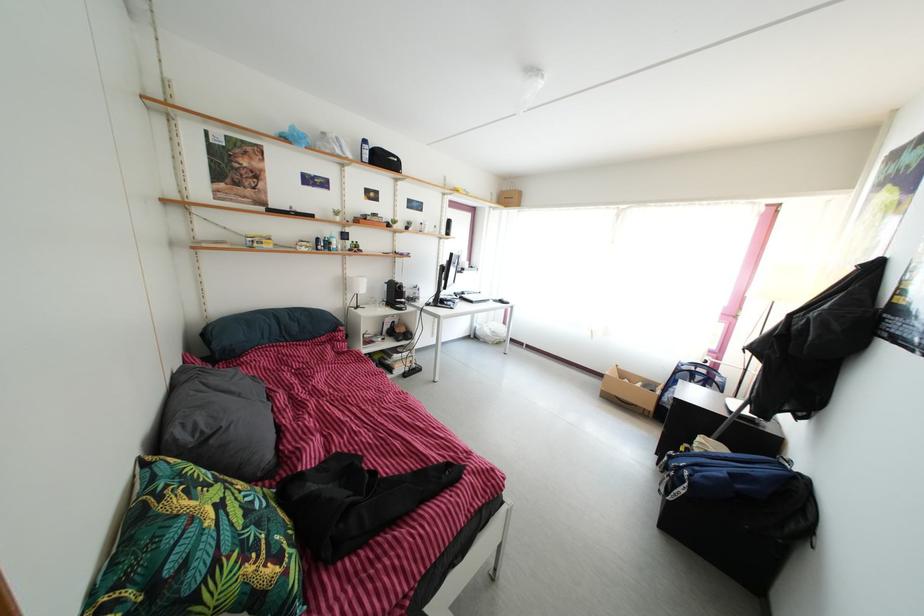
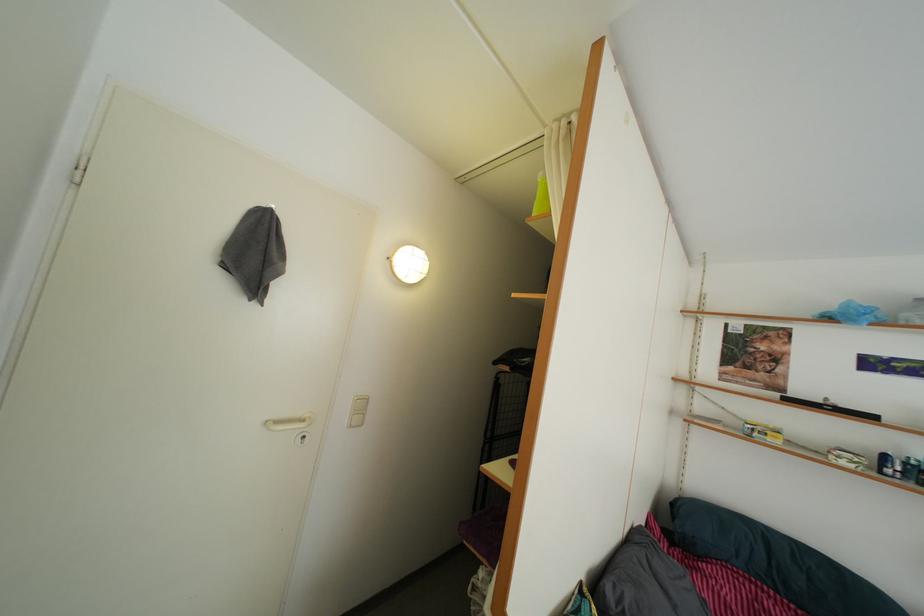
Question: How did the camera likely rotate?

Choices:
 (A) Left
 (B) Right
 (C) Up
 (D) Down

Answer: (A)